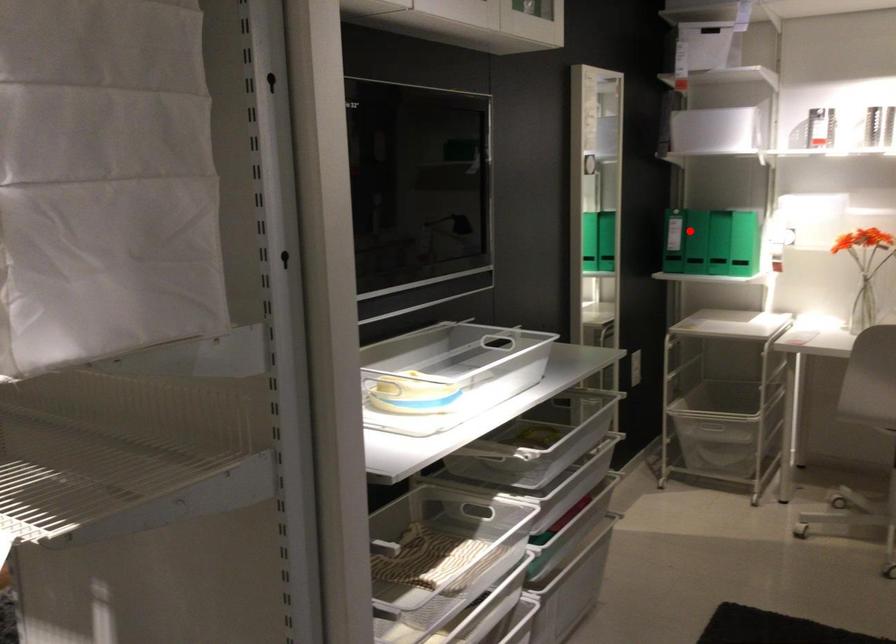
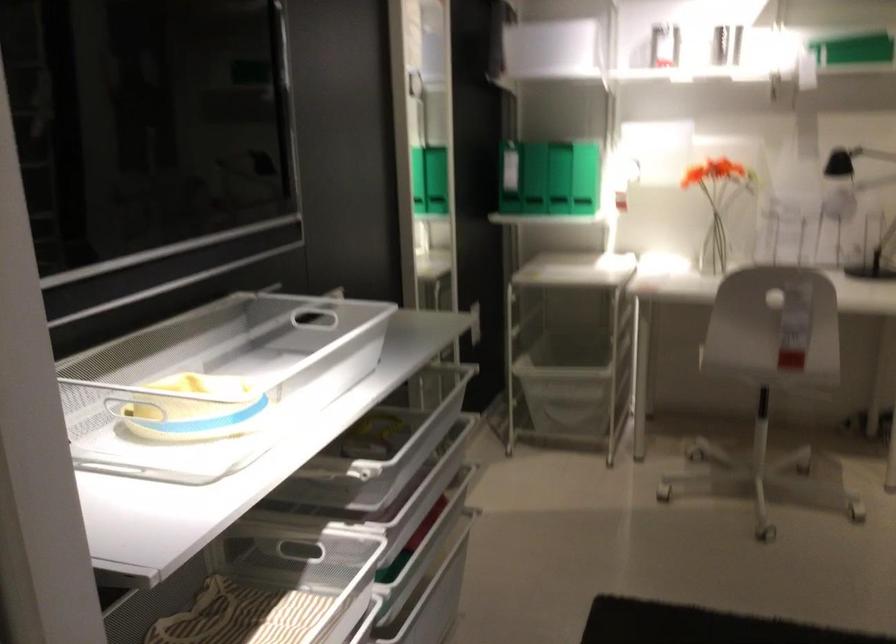
Where in the second image is the point corresponding to the highlighted location from the first image?

(511, 174)